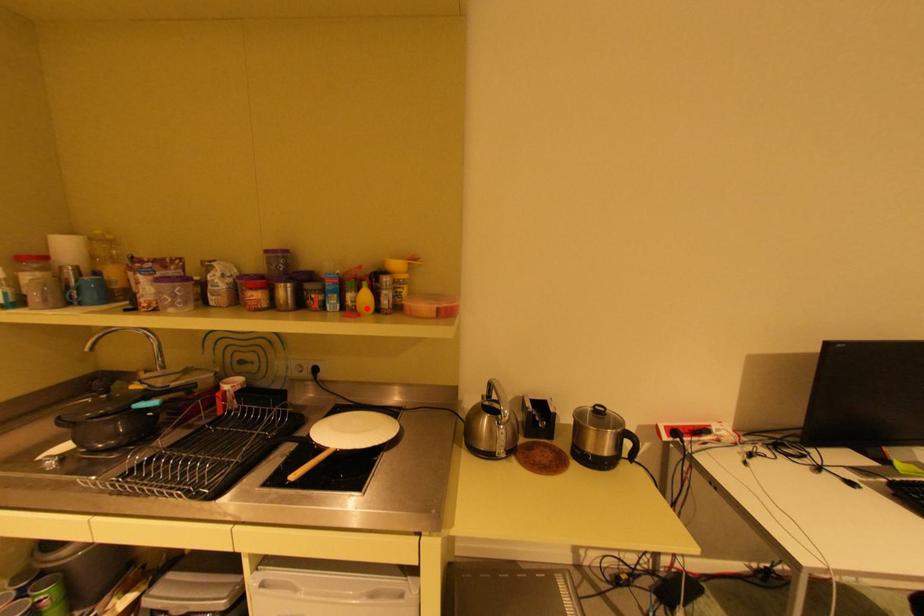
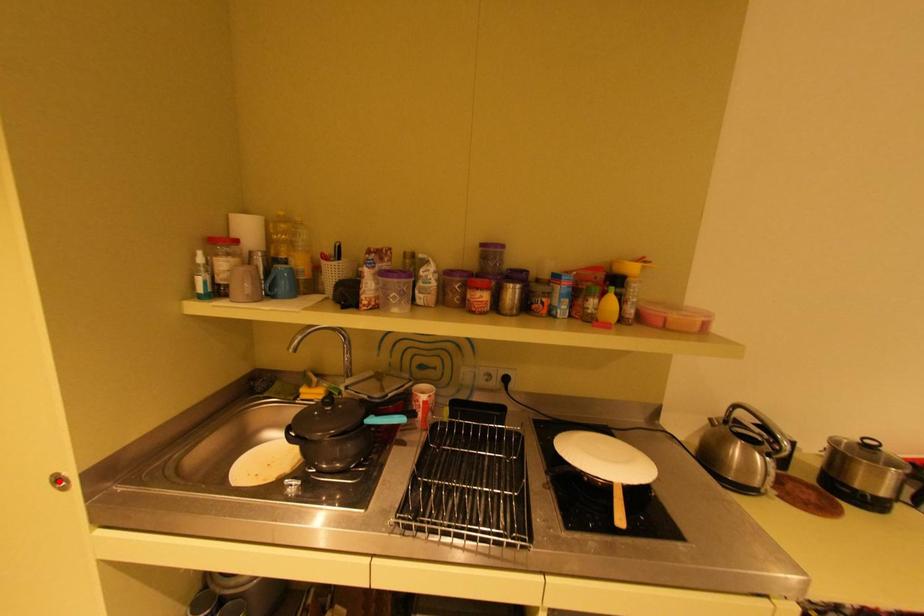
I am providing you with two images of the same scene from different viewpoints. A red point is marked on the first image and another point is marked on the second image. Is the marked point in image1 the same physical position as the marked point in image2?

No